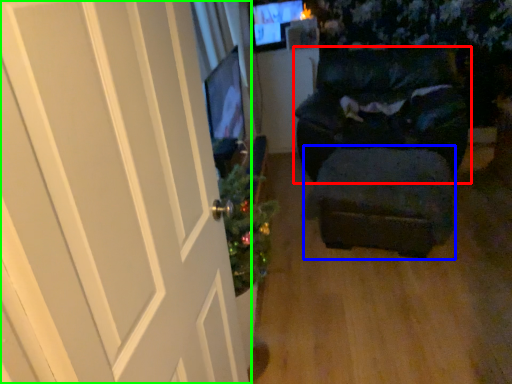
Question: Based on their relative distances, which object is nearer to furniture (highlighted by a red box)? Choose from stool (highlighted by a blue box) and door (highlighted by a green box).

Choices:
 (A) stool
 (B) door

Answer: (A)